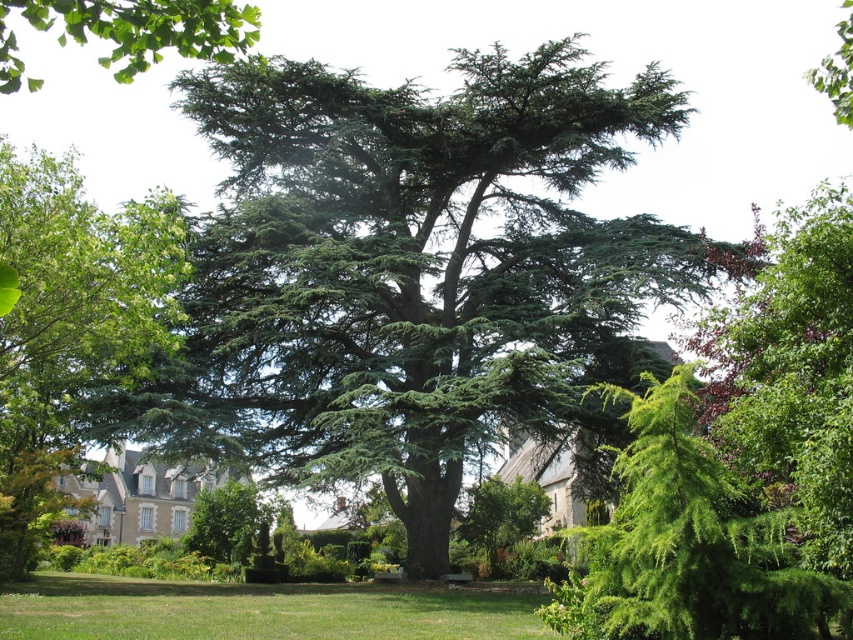
Question: Can you confirm if green leafy tree at left is smaller than green needle-like at center?

Choices:
 (A) no
 (B) yes

Answer: (A)

Question: Which of these objects is positioned farthest from the green textured tree at center?

Choices:
 (A) green needle-like at center
 (B) green needle-like tree at center
 (C) green needle-like tree at upper right

Answer: (C)

Question: Can you confirm if green leafy branch at upper left is wider than green needle-like tree at upper right?

Choices:
 (A) no
 (B) yes

Answer: (B)

Question: Which object appears farthest from the camera in this image?

Choices:
 (A) green needle-like at center
 (B) green needle-like tree at upper right
 (C) green textured tree at center

Answer: (C)

Question: Which point appears closest to the camera in this image?

Choices:
 (A) (490, 566)
 (B) (109, 51)
 (C) (618, 609)

Answer: (C)

Question: Can you confirm if green grass at lower center is positioned to the left of green leafy tree at center?

Choices:
 (A) no
 (B) yes

Answer: (B)